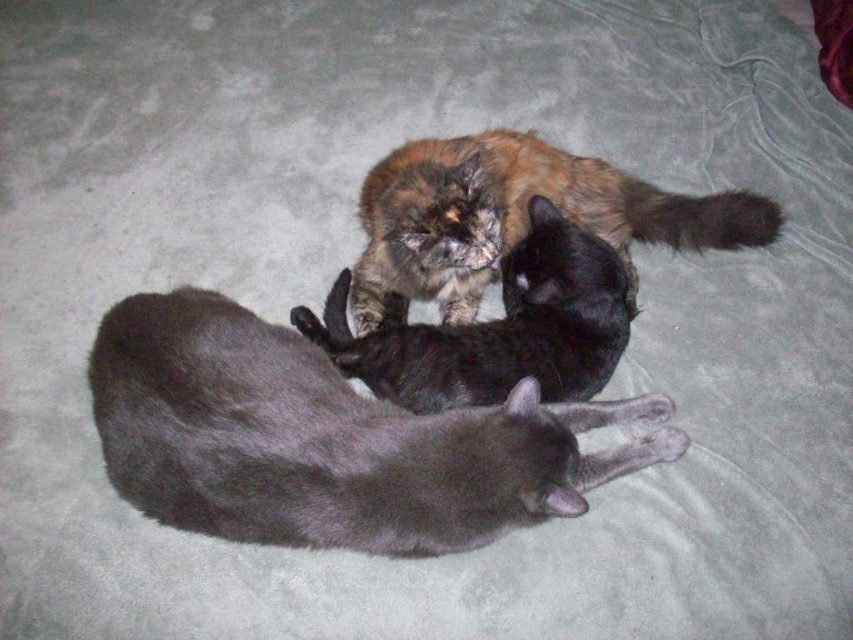
Based on the coordinates provided, which cat is located at point (328, 440)?

The silky gray cat at center is located at point (328, 440).

You are a photographer trying to capture a clear shot of both the silky gray cat at center and the multicolored fur cat at center. Since you want to ensure both are in focus, which cat should you adjust your camera focus to prioritize based on their height?

The silky gray cat at center is not as tall as the multicolored fur cat at center. To ensure both are in focus, prioritize focusing on the taller multicolored fur cat at center first, as it may require more precise focus due to its height difference.

You are a photographer trying to capture a clear photo of both the silky gray cat at center and the multicolored fluffy cat at center. Which cat should you focus on first to ensure both are in focus?

You should focus on the silky gray cat at center first since it is closer to the viewer. By focusing on the closer cat, the multicolored fluffy cat at center will also be in focus due to the depth of field extending backward.